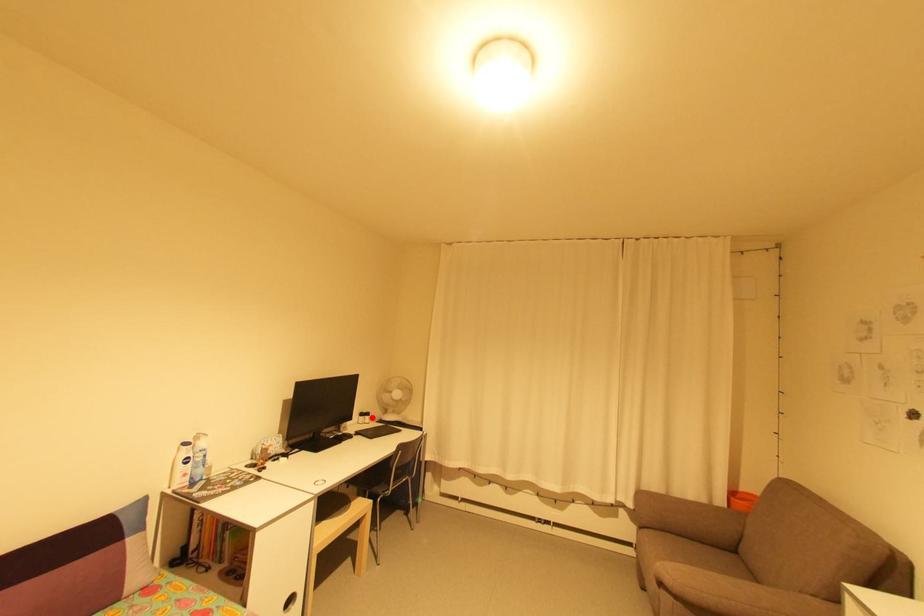
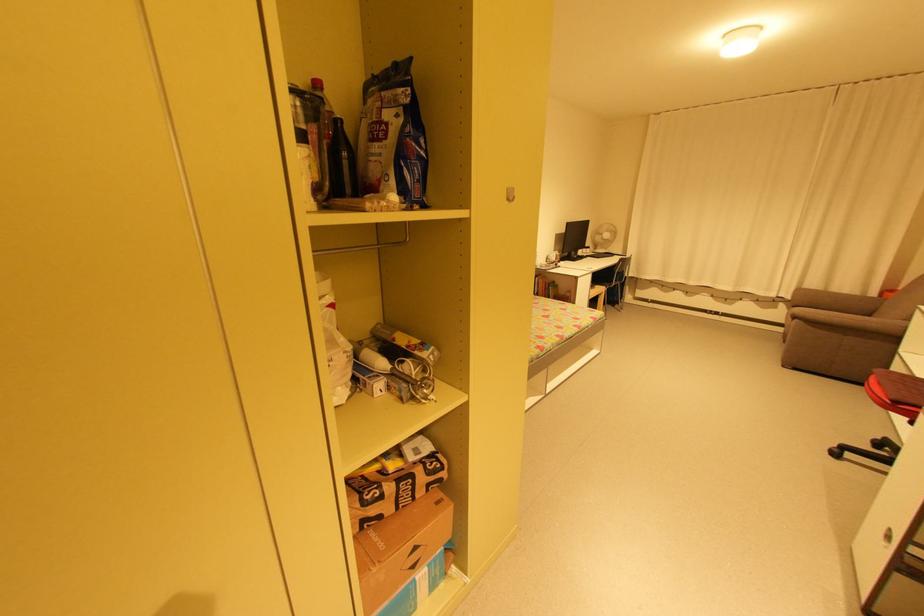
Question: I am providing you with two images of the same scene from different viewpoints. Given a red point in image1, look at the same physical point in image2. Is it:

Choices:
 (A) Closer to the viewpoint
 (B) Farther from the viewpoint

Answer: (A)